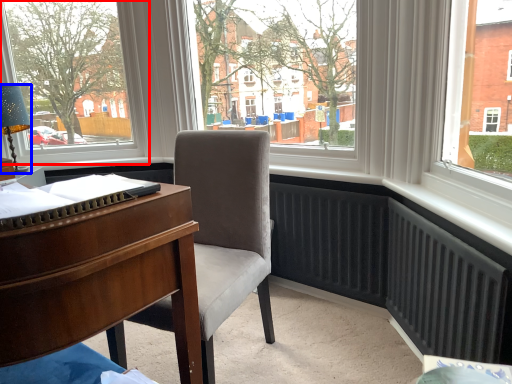
Question: Which object appears farthest to the camera in this image, window (highlighted by a red box) or lamp (highlighted by a blue box)?

Choices:
 (A) window
 (B) lamp

Answer: (A)